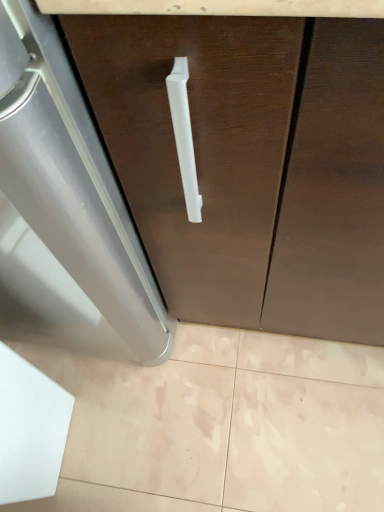
The height and width of the screenshot is (512, 384). What do you see at coordinates (251, 163) in the screenshot?
I see `white plastic handle at center` at bounding box center [251, 163].

Identify the location of white plastic handle at center. (251, 163).

Locate an element on the screen. The height and width of the screenshot is (512, 384). white plastic handle at center is located at coordinates (251, 163).